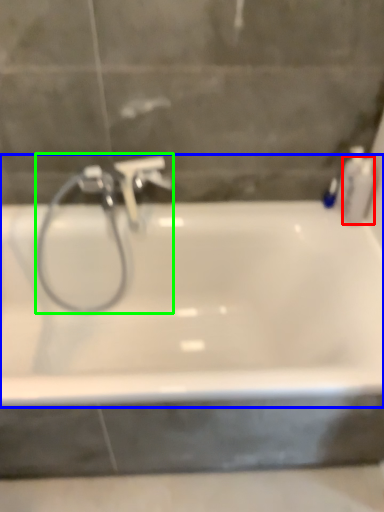
Question: Based on their relative distances, which object is farther from toiletry (highlighted by a red box)? Choose from bathtub (highlighted by a blue box) and plumbing fixture (highlighted by a green box).

Choices:
 (A) bathtub
 (B) plumbing fixture

Answer: (B)